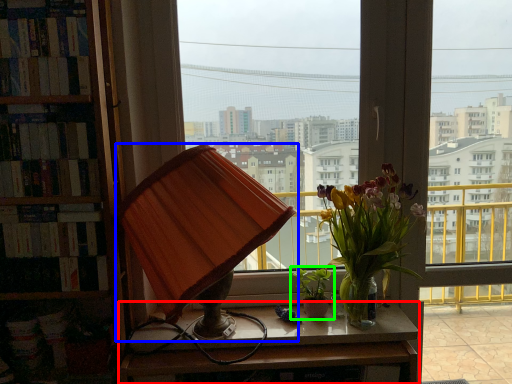
Question: Which object is the closest to the desk (highlighted by a red box)? Choose among these: lamp (highlighted by a blue box) or houseplant (highlighted by a green box).

Choices:
 (A) lamp
 (B) houseplant

Answer: (B)